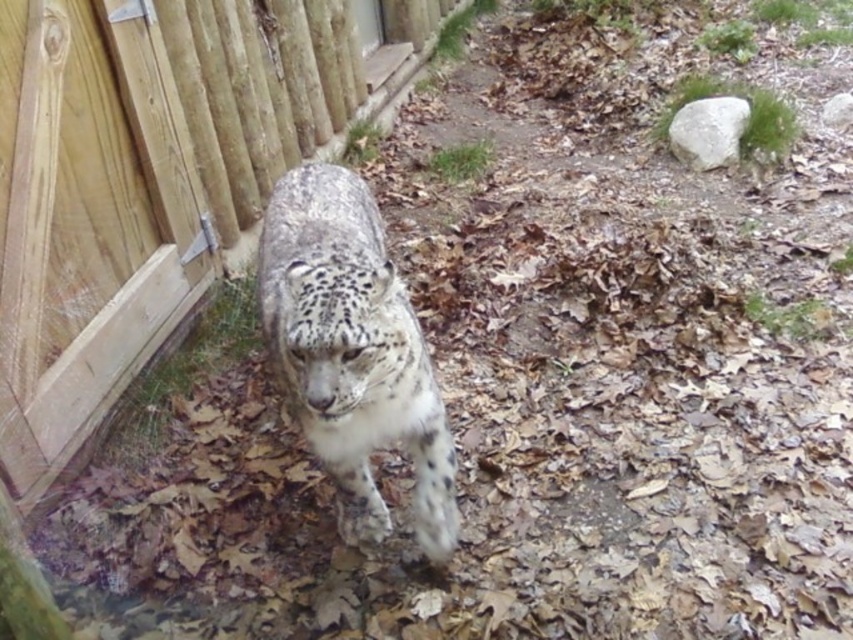
Question: Observing the image, what is the correct spatial positioning of wooden fence at left in reference to spotted fur snow leopard at center?

Choices:
 (A) above
 (B) below

Answer: (A)

Question: Does wooden fence at left have a greater width compared to spotted fur snow leopard at center?

Choices:
 (A) yes
 (B) no

Answer: (A)

Question: Among these points, which one is farthest from the camera?

Choices:
 (A) (234, 124)
 (B) (404, 365)

Answer: (A)

Question: Can you confirm if wooden fence at left is positioned to the left of spotted fur snow leopard at center?

Choices:
 (A) yes
 (B) no

Answer: (A)

Question: Which point appears farthest from the camera in this image?

Choices:
 (A) (177, 289)
 (B) (343, 468)

Answer: (A)

Question: Which point is closer to the camera taking this photo?

Choices:
 (A) (387, 321)
 (B) (322, 96)

Answer: (A)